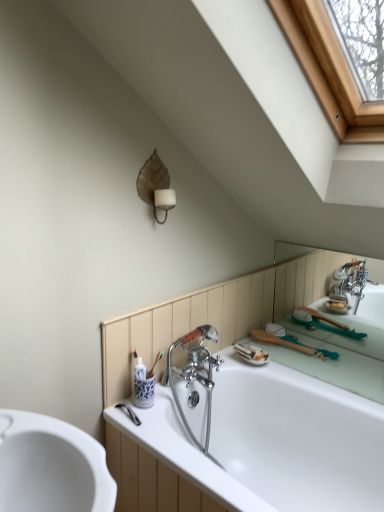
This screenshot has width=384, height=512. What do you see at coordinates (265, 442) in the screenshot?
I see `white glossy bathtub at center` at bounding box center [265, 442].

This screenshot has height=512, width=384. Identify the location of white glossy bathtub at center. (265, 442).

What do you see at coordinates (156, 186) in the screenshot?
I see `brown leaf-shaped sconce at upper center` at bounding box center [156, 186].

Where is `brown leaf-shaped sconce at upper center`? brown leaf-shaped sconce at upper center is located at coordinates (156, 186).

This screenshot has height=512, width=384. Identify the location of white glossy bathtub at center. (265, 442).

Would you say white glossy bathtub at center is to the left or to the right of brown leaf-shaped sconce at upper center in the picture?

Clearly, white glossy bathtub at center is on the right of brown leaf-shaped sconce at upper center in the image.

Is white glossy bathtub at center closer to the viewer compared to brown leaf-shaped sconce at upper center?

Yes, it is in front of brown leaf-shaped sconce at upper center.

Is point (308, 441) closer or farther from the camera than point (154, 163)?

Clearly, point (308, 441) is more distant from the camera than point (154, 163).

From the image's perspective, would you say white glossy bathtub at center is positioned over brown leaf-shaped sconce at upper center?

Incorrect, from the image's perspective, white glossy bathtub at center is lower than brown leaf-shaped sconce at upper center.

From a real-world perspective, is white glossy bathtub at center located beneath brown leaf-shaped sconce at upper center?

Correct, in the physical world, white glossy bathtub at center is lower than brown leaf-shaped sconce at upper center.

Which of these two, white glossy bathtub at center or brown leaf-shaped sconce at upper center, is thinner?

brown leaf-shaped sconce at upper center is thinner.

Between white glossy bathtub at center and brown leaf-shaped sconce at upper center, which one has less height?

brown leaf-shaped sconce at upper center.

Who is smaller, white glossy bathtub at center or brown leaf-shaped sconce at upper center?

Smaller between the two is brown leaf-shaped sconce at upper center.

Would you say white glossy bathtub at center is outside brown leaf-shaped sconce at upper center?

Yes, white glossy bathtub at center is located beyond the bounds of brown leaf-shaped sconce at upper center.

Is there a large distance between white glossy bathtub at center and brown leaf-shaped sconce at upper center?

No, white glossy bathtub at center is not far from brown leaf-shaped sconce at upper center.

Is white glossy bathtub at center looking in the opposite direction of brown leaf-shaped sconce at upper center?

No, white glossy bathtub at center's orientation is not away from brown leaf-shaped sconce at upper center.

The image size is (384, 512). I want to click on bathtub located underneath the brown leaf-shaped sconce at upper center (from a real-world perspective), so click(265, 442).

Which is more to the left, brown leaf-shaped sconce at upper center or white glossy bathtub at center?

Positioned to the left is brown leaf-shaped sconce at upper center.

Is brown leaf-shaped sconce at upper center behind white glossy bathtub at center?

Yes, it is.

Considering the points (145, 197) and (304, 468), which point is behind, point (145, 197) or point (304, 468)?

Point (304, 468)

Based on the photo, from the image's perspective, is brown leaf-shaped sconce at upper center under white glossy bathtub at center?

Actually, brown leaf-shaped sconce at upper center appears above white glossy bathtub at center in the image.

From a real-world perspective, is brown leaf-shaped sconce at upper center beneath white glossy bathtub at center?

Actually, brown leaf-shaped sconce at upper center is physically above white glossy bathtub at center in the real world.

Looking at their sizes, would you say brown leaf-shaped sconce at upper center is wider or thinner than white glossy bathtub at center?

brown leaf-shaped sconce at upper center is thinner than white glossy bathtub at center.

Considering the sizes of objects brown leaf-shaped sconce at upper center and white glossy bathtub at center in the image provided, who is taller, brown leaf-shaped sconce at upper center or white glossy bathtub at center?

Standing taller between the two is white glossy bathtub at center.

Considering the sizes of brown leaf-shaped sconce at upper center and white glossy bathtub at center in the image, is brown leaf-shaped sconce at upper center bigger or smaller than white glossy bathtub at center?

Clearly, brown leaf-shaped sconce at upper center is smaller in size than white glossy bathtub at center.

Is white glossy bathtub at center surrounded by brown leaf-shaped sconce at upper center?

That's incorrect, white glossy bathtub at center is not inside brown leaf-shaped sconce at upper center.

Is brown leaf-shaped sconce at upper center directly adjacent to white glossy bathtub at center?

No, brown leaf-shaped sconce at upper center is not touching white glossy bathtub at center.

Is brown leaf-shaped sconce at upper center oriented away from white glossy bathtub at center?

brown leaf-shaped sconce at upper center is not turned away from white glossy bathtub at center.

What's the angular difference between brown leaf-shaped sconce at upper center and white glossy bathtub at center's facing directions?

The angle between the facing direction of brown leaf-shaped sconce at upper center and the facing direction of white glossy bathtub at center is 92 degrees.

Find the location of a particular element. bathtub in front of the brown leaf-shaped sconce at upper center is located at coordinates (265, 442).

The height and width of the screenshot is (512, 384). In the image, there is a brown leaf-shaped sconce at upper center. Find the location of `bathtub below it (from a real-world perspective)`. bathtub below it (from a real-world perspective) is located at coordinates (265, 442).

At what (x,y) coordinates should I click in order to perform the action: click on fixture behind the white glossy bathtub at center. Please return your answer as a coordinate pair (x, y). Looking at the image, I should click on (156, 186).